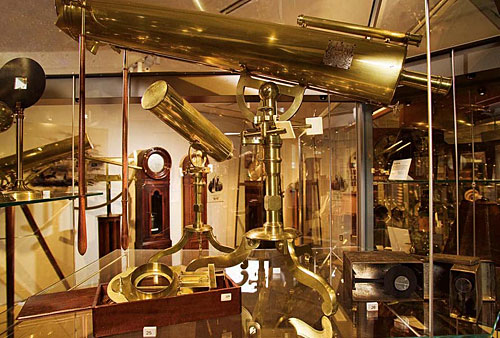
Locate an element on the screen. The image size is (500, 338). box is located at coordinates (138, 318), (63, 301).